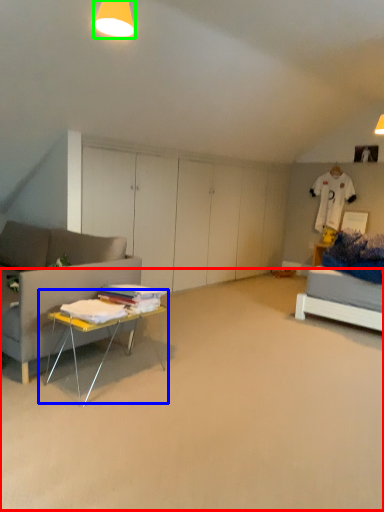
Question: Estimate the real-world distances between objects in this image. Which object is closer to plain (highlighted by a red box), table (highlighted by a blue box) or lighting (highlighted by a green box)?

Choices:
 (A) table
 (B) lighting

Answer: (A)